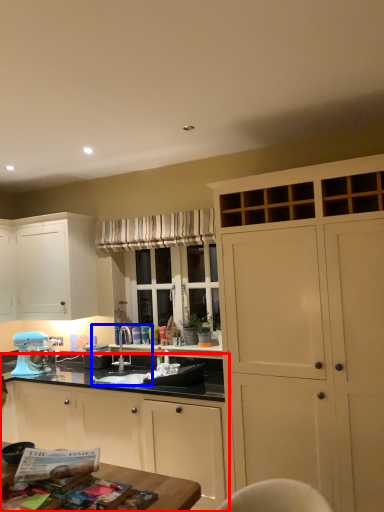
Question: Which point is closer to the camera, cabinetry (highlighted by a red box) or sink (highlighted by a blue box)?

Choices:
 (A) cabinetry
 (B) sink

Answer: (A)